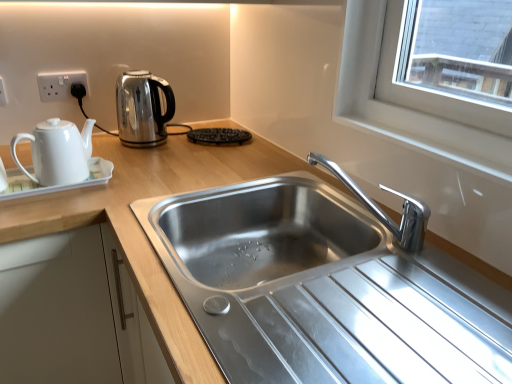
Question: Is chrome metallic faucet at center positioned with its back to black textured waffle iron at center?

Choices:
 (A) no
 (B) yes

Answer: (A)

Question: Is chrome metallic faucet at center to the left of black textured waffle iron at center from the viewer's perspective?

Choices:
 (A) no
 (B) yes

Answer: (A)

Question: From a real-world perspective, is chrome metallic faucet at center located beneath black textured waffle iron at center?

Choices:
 (A) yes
 (B) no

Answer: (B)

Question: Is chrome metallic faucet at center located outside black textured waffle iron at center?

Choices:
 (A) no
 (B) yes

Answer: (B)

Question: Is black textured waffle iron at center surrounded by chrome metallic faucet at center?

Choices:
 (A) no
 (B) yes

Answer: (A)

Question: Does chrome metallic faucet at center turn towards black textured waffle iron at center?

Choices:
 (A) no
 (B) yes

Answer: (A)

Question: From a real-world perspective, is black textured waffle iron at center positioned over white plastic electric outlet at upper left, which ranks as the 1th electric outlet in left-to-right order, based on gravity?

Choices:
 (A) no
 (B) yes

Answer: (A)

Question: Is black textured waffle iron at center oriented towards white plastic electric outlet at upper left, acting as the 1th electric outlet starting from the front?

Choices:
 (A) yes
 (B) no

Answer: (B)

Question: Is black textured waffle iron at center directly adjacent to white plastic electric outlet at upper left, the second electric outlet viewed from the right?

Choices:
 (A) yes
 (B) no

Answer: (B)

Question: Can we say black textured waffle iron at center lies outside white plastic electric outlet at upper left, acting as the 1th electric outlet starting from the front?

Choices:
 (A) no
 (B) yes

Answer: (B)

Question: Is black textured waffle iron at center thinner than white plastic electric outlet at upper left, acting as the 1th electric outlet starting from the front?

Choices:
 (A) no
 (B) yes

Answer: (A)

Question: Considering the relative sizes of black textured waffle iron at center and white plastic electric outlet at upper left, acting as the 1th electric outlet starting from the front, in the image provided, is black textured waffle iron at center shorter than white plastic electric outlet at upper left, acting as the 1th electric outlet starting from the front,?

Choices:
 (A) no
 (B) yes

Answer: (B)

Question: Is black textured waffle iron at center at the left side of chrome metallic faucet at center?

Choices:
 (A) no
 (B) yes

Answer: (B)